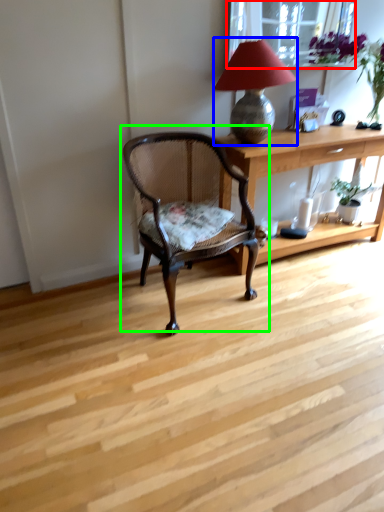
Question: Considering the real-world distances, which object is closest to window screen (highlighted by a red box)? lamp (highlighted by a blue box) or chair (highlighted by a green box).

Choices:
 (A) lamp
 (B) chair

Answer: (A)